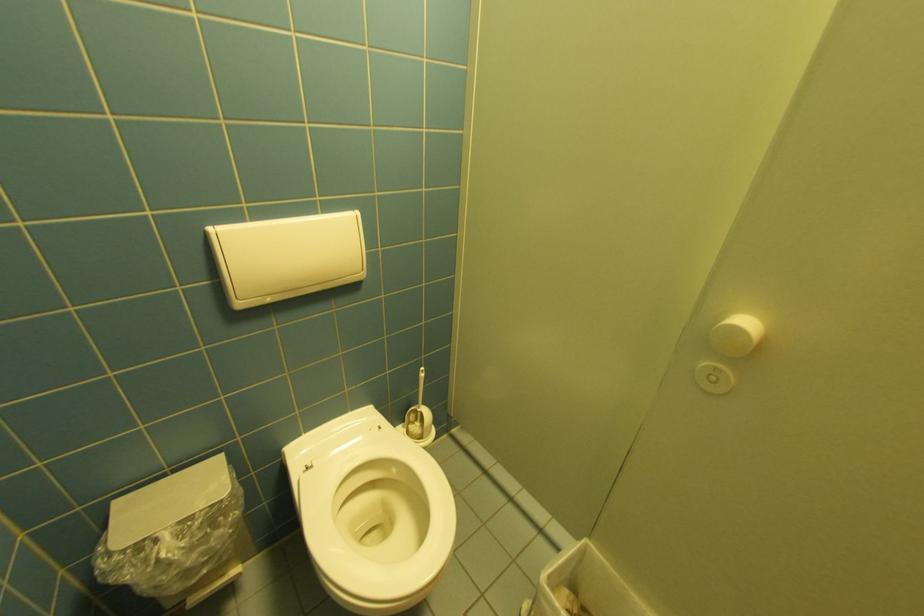
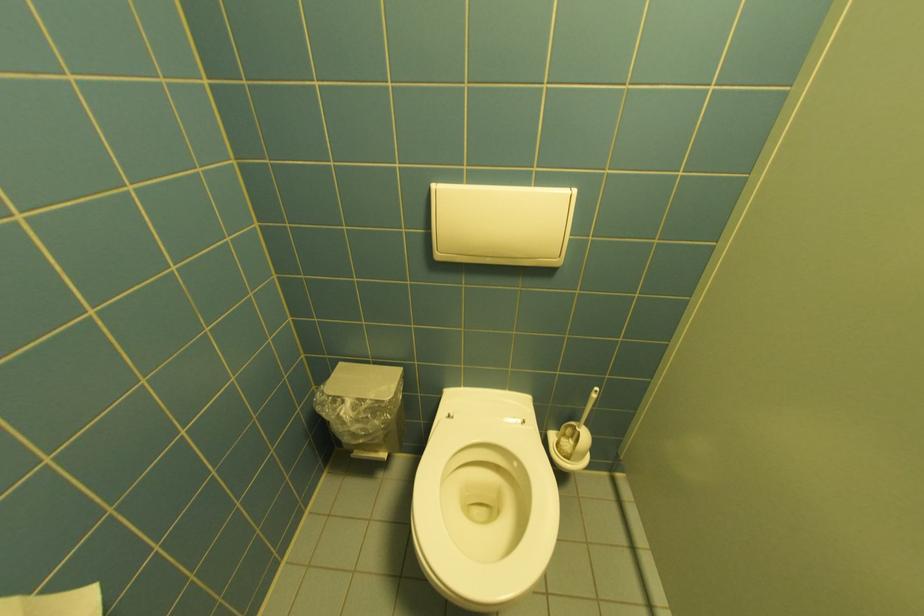
Question: The camera is either moving clockwise (left) or counter-clockwise (right) around the object. The first image is from the beginning of the video and the second image is from the end. Is the camera moving left or right when shooting the video?

Choices:
 (A) Left
 (B) Right

Answer: (B)